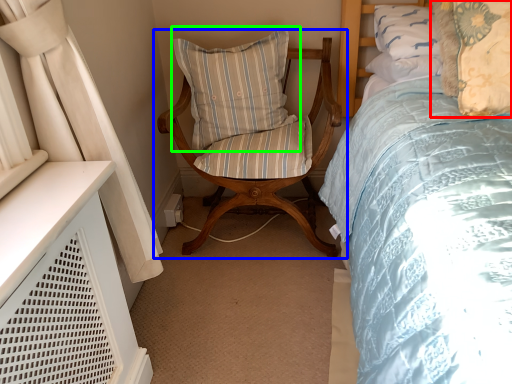
Question: Based on their relative distances, which object is farther from pillow (highlighted by a red box)? Choose from chair (highlighted by a blue box) and pillow (highlighted by a green box).

Choices:
 (A) chair
 (B) pillow

Answer: (B)